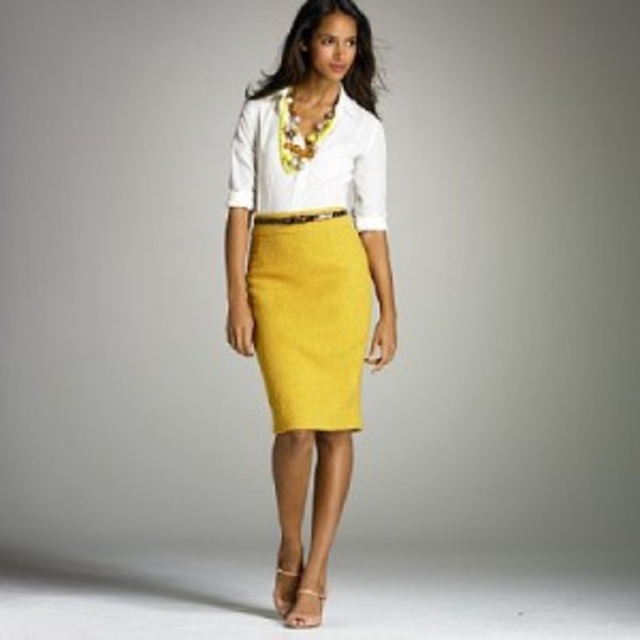
You are a fashion designer trying to create a new outfit. You have two options for the skirt part of the outfit. The first is the matte yellow skirt at center, and the second is the matte yellow pencil skirt at center. Which one is wider?

The matte yellow skirt at center is wider than the matte yellow pencil skirt at center.

You are a fashion designer observing the outfit of a person in the image. Which item is positioned lower on the body between the matte yellow skirt at center and the white cotton shirt at center?

The matte yellow skirt at center is located below the white cotton shirt at center, so it is positioned lower on the body.

You are a fashion designer looking at this outfit. You need to determine the order of the layers from top to bottom. Which item is placed above the other between the matte yellow pencil skirt at center and the white cotton shirt at center?

The white cotton shirt at center is placed above the matte yellow pencil skirt at center because the skirt is positioned under the shirt.